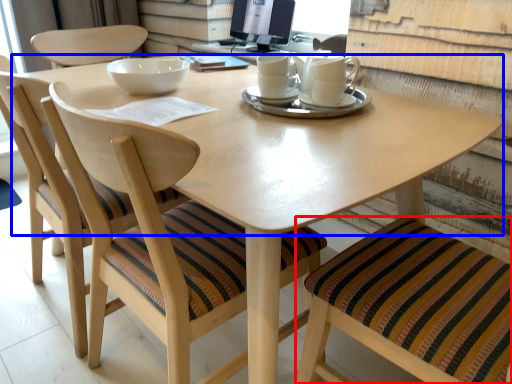
Question: Which of the following is the closest to the observer, chair (highlighted by a red box) or round table (highlighted by a blue box)?

Choices:
 (A) chair
 (B) round table

Answer: (A)